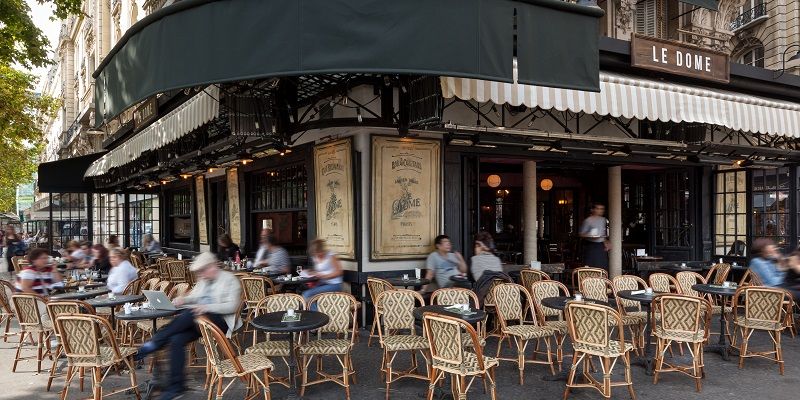
Identify the location of decorate posters. This screenshot has height=400, width=800. (328, 189), (384, 192), (236, 199), (206, 217).